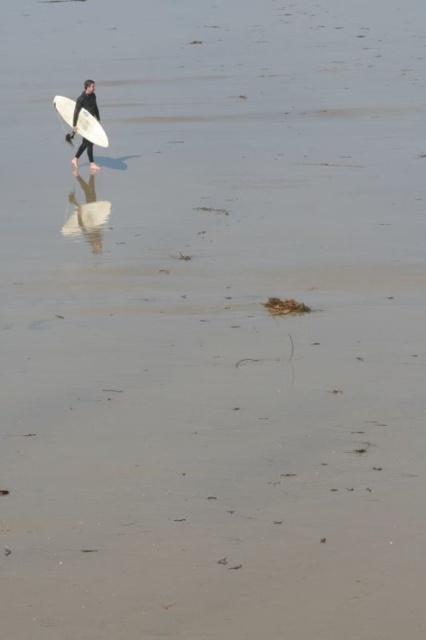
Question: Is white matte surfboard at center in front of black matte wetsuit at upper left?

Choices:
 (A) yes
 (B) no

Answer: (B)

Question: Does white matte surfboard at center appear under black matte wetsuit at upper left?

Choices:
 (A) no
 (B) yes

Answer: (A)

Question: Can you confirm if white matte surfboard at center is thinner than black matte wetsuit at upper left?

Choices:
 (A) no
 (B) yes

Answer: (A)

Question: Which object appears farthest from the camera in this image?

Choices:
 (A) black matte wetsuit at upper left
 (B) white matte surfboard at center

Answer: (B)